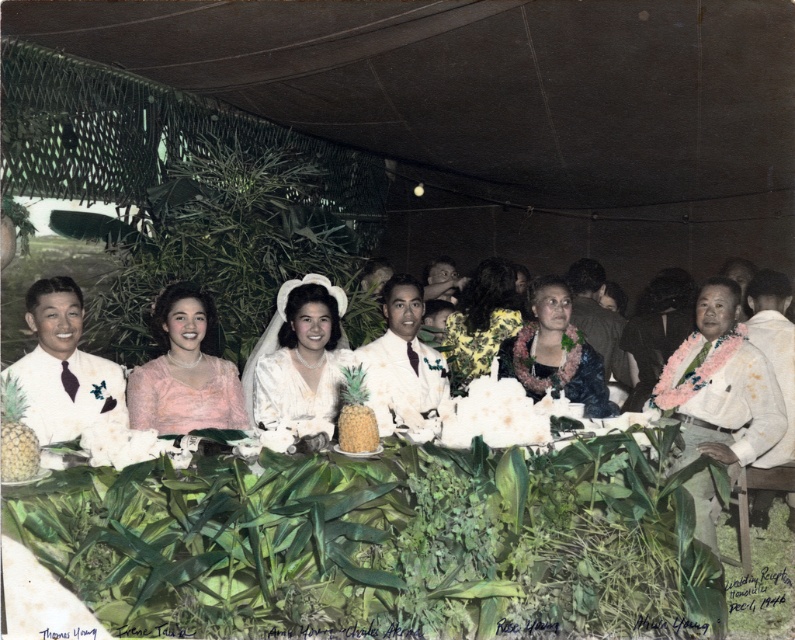
Question: Which is nearer to the white fluffy flower at center?

Choices:
 (A) white fabric flower at center
 (B) yellow matte pineapple at center

Answer: (B)

Question: Estimate the real-world distances between objects in this image. Which object is closer to the yellow matte pineapple at center?

Choices:
 (A) white fluffy flower at center
 (B) white satin dress at center
 (C) yellow textured pineapple at left
 (D) white fabric flower at center

Answer: (A)

Question: Estimate the real-world distances between objects in this image. Which object is closer to the floral-patterned dress at center?

Choices:
 (A) white satin dress at center
 (B) yellow matte pineapple at center

Answer: (A)

Question: Is white satin dress at center positioned before white fluffy flower at center?

Choices:
 (A) no
 (B) yes

Answer: (A)

Question: Considering the relative positions of pale pink satin dress at center and white fluffy flower at center in the image provided, where is pale pink satin dress at center located with respect to white fluffy flower at center?

Choices:
 (A) right
 (B) left

Answer: (B)

Question: Is white fluffy flower at center to the left of white fabric flower at center from the viewer's perspective?

Choices:
 (A) no
 (B) yes

Answer: (A)